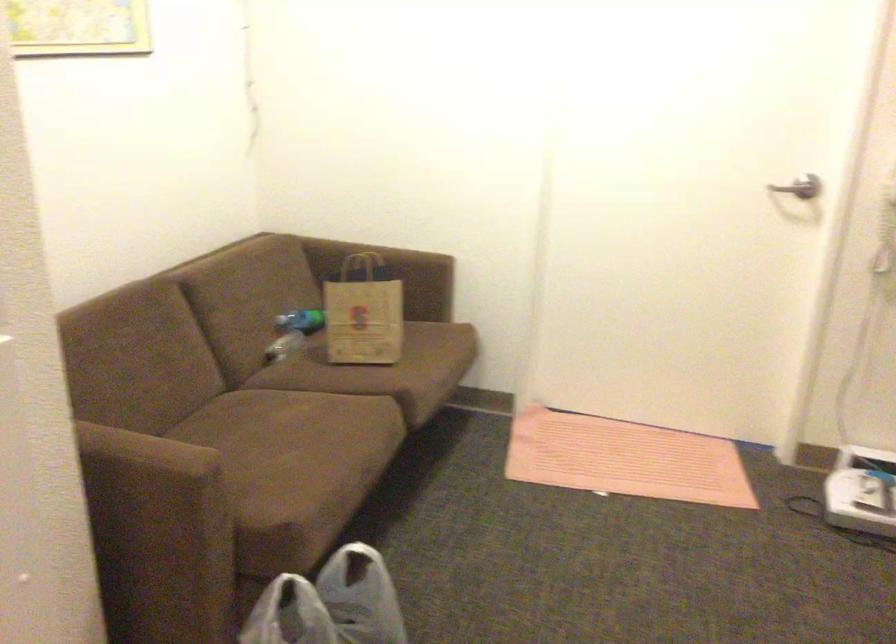
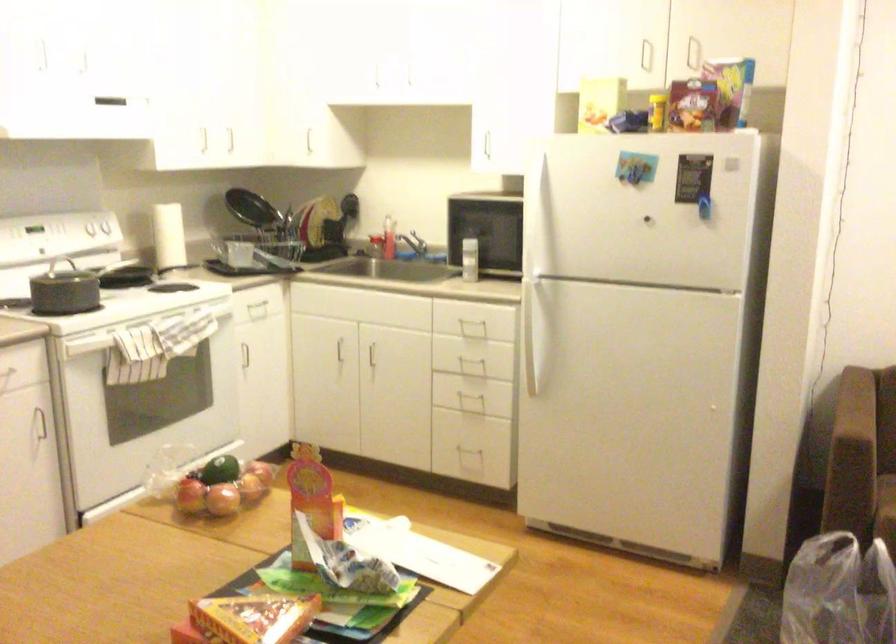
Find the pixel in the second image that matches pixel 211 571 in the first image.

(863, 513)